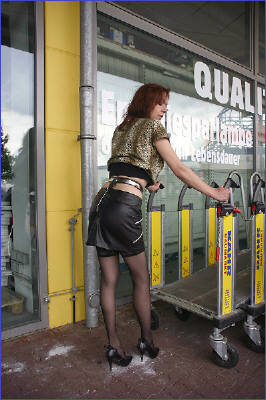
Image resolution: width=266 pixels, height=400 pixels. What are the coordinates of `wall` in the screenshot? It's located at (63, 94).